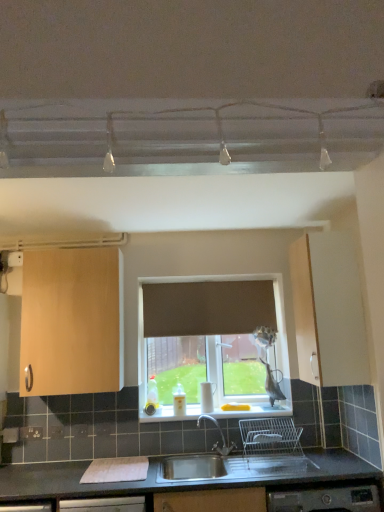
Question: In terms of width, does white plastic electric outlet at lower left look wider or thinner when compared to white glossy window sill at center?

Choices:
 (A) wide
 (B) thin

Answer: (B)

Question: From a real-world perspective, relative to white glossy window sill at center, is white plastic electric outlet at lower left vertically above or below?

Choices:
 (A) above
 (B) below

Answer: (B)

Question: Which is farther from the light wood cabinet at left, which is the 2th cabinetry in right-to-left order?

Choices:
 (A) white glossy window sill at center
 (B) brown fabric curtain at center
 (C) matte wood cabinet at right, which appears as the first cabinetry when viewed from the right
 (D) white plastic electric outlet at lower left
 (E) stainless steel sink at lower center

Answer: (C)

Question: Considering the real-world distances, which object is closest to the brown fabric curtain at center?

Choices:
 (A) matte wood cabinet at right, which appears as the first cabinetry when viewed from the right
 (B) stainless steel sink at lower center
 (C) white glossy window sill at center
 (D) white plastic electric outlet at lower left
 (E) light wood cabinet at left, which is the 2th cabinetry in right-to-left order

Answer: (A)